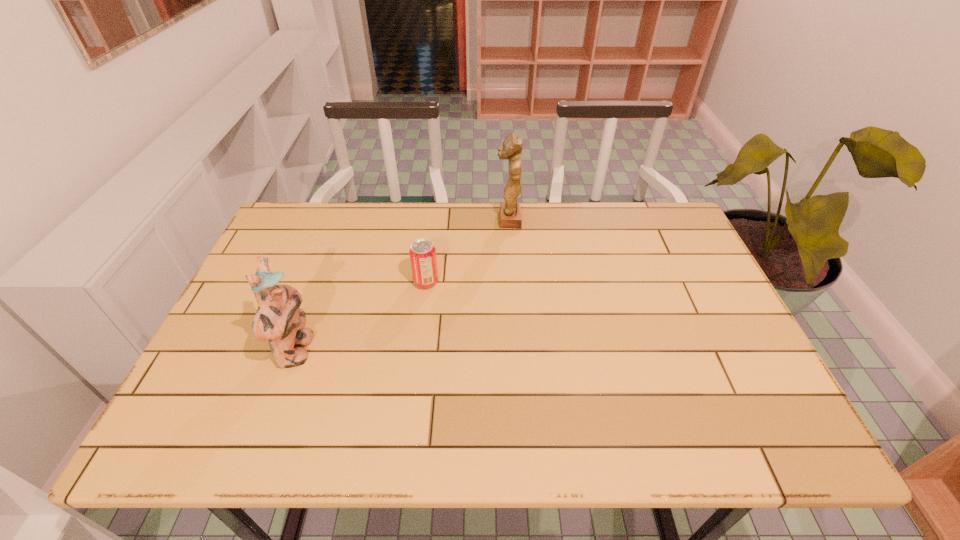
Find the location of a particular element. This screenshot has height=540, width=960. free point located 0.260m on the back of the second object from left to right is located at coordinates (434, 218).

Locate an element on the screen. The height and width of the screenshot is (540, 960). object located at the far edge is located at coordinates (510, 212).

At what (x,y) coordinates should I click in order to perform the action: click on object present at the left edge. Please return your answer as a coordinate pair (x, y). Looking at the image, I should click on pyautogui.click(x=279, y=321).

Find the location of a particular element. This screenshot has height=540, width=960. free space at the far edge of the desktop is located at coordinates coord(613,207).

This screenshot has width=960, height=540. In order to click on vacant space at the left edge of the desktop in this screenshot , I will do `click(282, 253)`.

The height and width of the screenshot is (540, 960). In the image, there is a desktop. What are the coordinates of `vacant space at the right edge` in the screenshot? It's located at (663, 266).

This screenshot has width=960, height=540. Identify the location of vacant space at the far right corner. (660, 248).

At what (x,y) coordinates should I click in order to perform the action: click on free space that is in between the soda and the rightmost object. Please return your answer as a coordinate pair (x, y). This screenshot has height=540, width=960. Looking at the image, I should click on (468, 251).

Locate an element on the screen. The height and width of the screenshot is (540, 960). vacant region between the soda and the nearer figurine is located at coordinates (361, 317).

You are a GUI agent. You are given a task and a screenshot of the screen. Output one action in this format:
    pyautogui.click(x=<x>, y=<y>)
    Task: Click on the free space between the nearest object and the farthest object
    Image resolution: width=960 pixels, height=540 pixels.
    Given the screenshot: What is the action you would take?
    pyautogui.click(x=402, y=286)